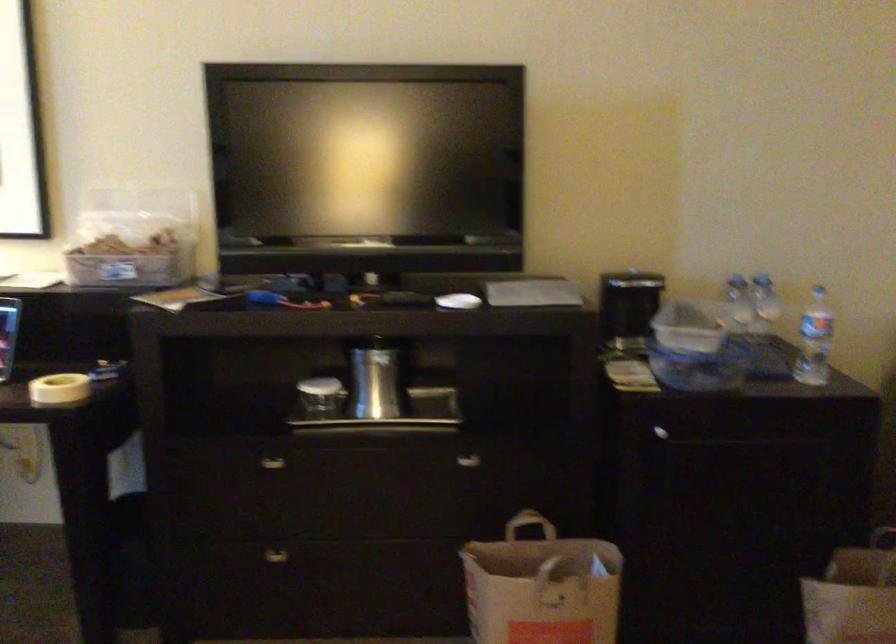
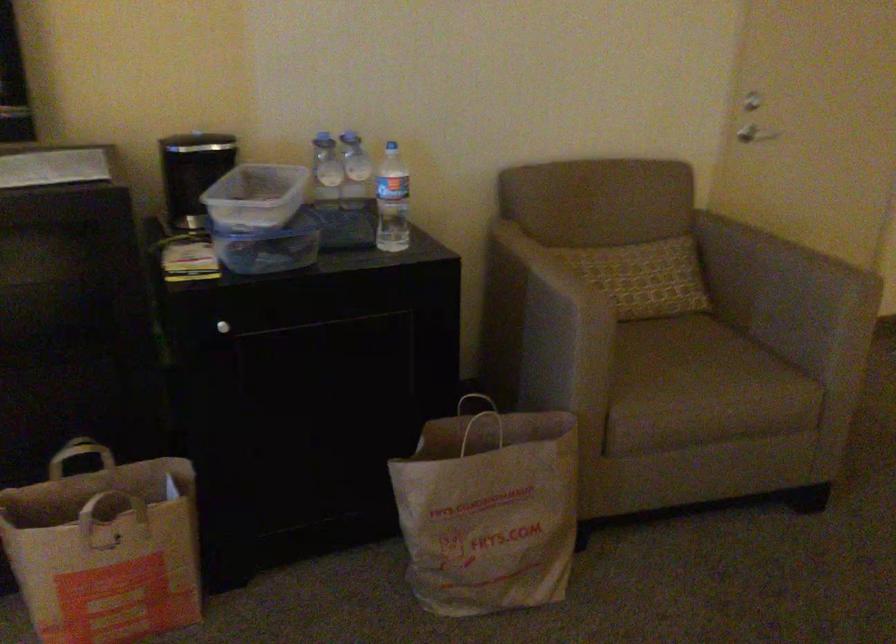
In the second image, find the point that corresponds to pixel 655 431 in the first image.

(222, 327)